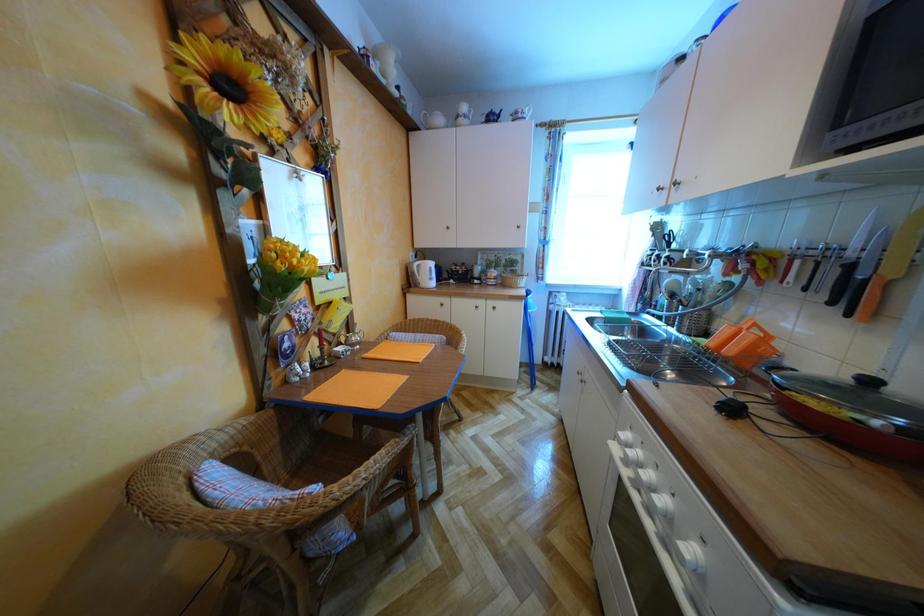
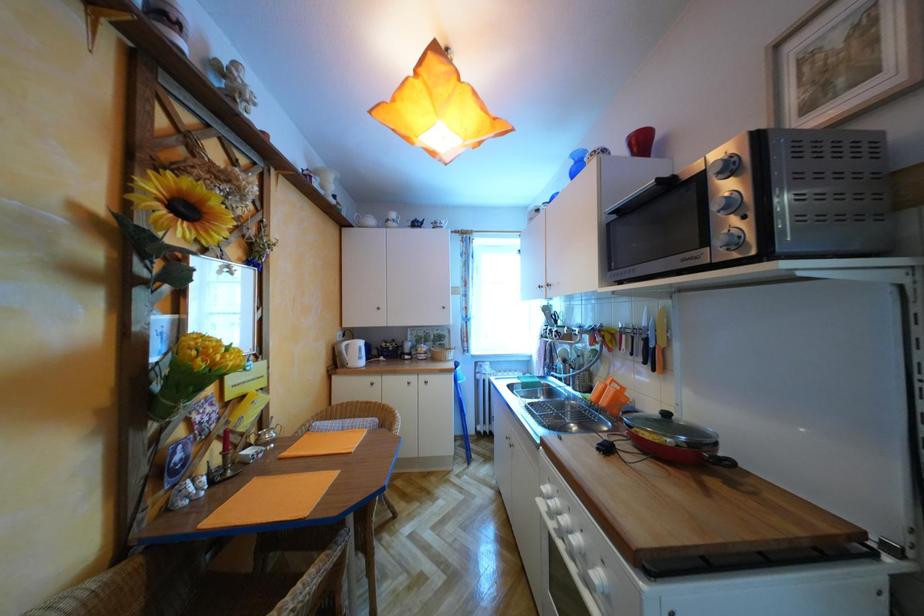
The images are taken continuously from a first-person perspective. In which direction is your viewpoint rotating?

The rotation direction of the camera is right-up.